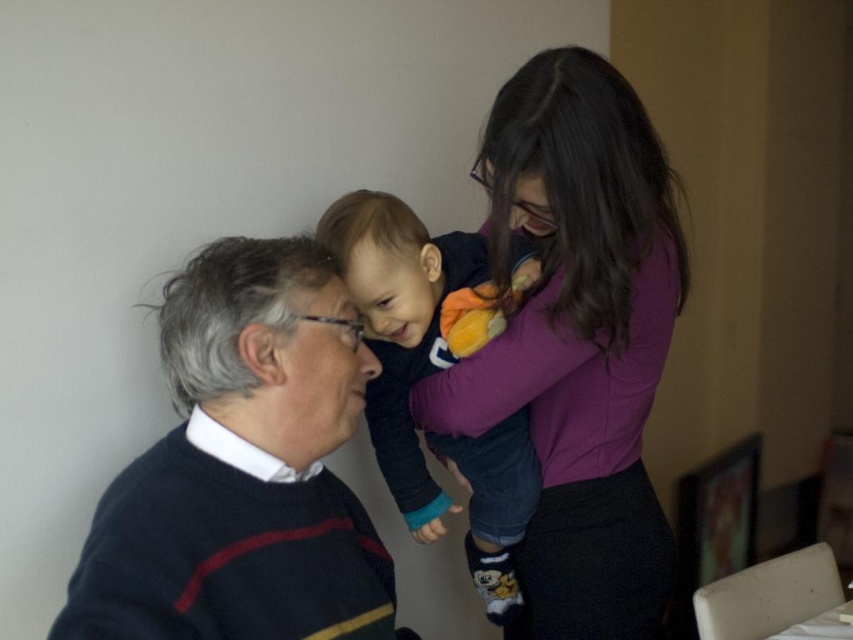
Question: Is purple matte shirt at upper right to the left of dark blue fleece at center from the viewer's perspective?

Choices:
 (A) no
 (B) yes

Answer: (A)

Question: Is purple matte shirt at upper right thinner than dark blue fleece at center?

Choices:
 (A) yes
 (B) no

Answer: (B)

Question: Is purple matte shirt at upper right below dark blue sweater at left?

Choices:
 (A) yes
 (B) no

Answer: (B)

Question: Which object is closer to the camera taking this photo?

Choices:
 (A) dark blue fleece at center
 (B) dark blue sweater at left

Answer: (B)

Question: Which of the following is the farthest from the observer?

Choices:
 (A) (260, 545)
 (B) (558, 177)

Answer: (B)

Question: Estimate the real-world distances between objects in this image. Which object is farther from the dark blue fleece at center?

Choices:
 (A) purple matte shirt at upper right
 (B) dark blue sweater at left

Answer: (B)